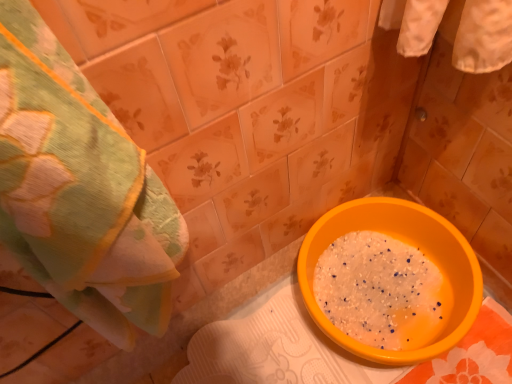
Question: In the image, is orange plastic basin at lower right positioned in front of or behind green textured towel at left?

Choices:
 (A) behind
 (B) front

Answer: (A)

Question: Considering the positions of orange plastic basin at lower right and green textured towel at left in the image, is orange plastic basin at lower right bigger or smaller than green textured towel at left?

Choices:
 (A) small
 (B) big

Answer: (B)

Question: Looking at their shapes, would you say orange plastic basin at lower right is wider or thinner than green textured towel at left?

Choices:
 (A) wide
 (B) thin

Answer: (A)

Question: Considering the relative positions of green textured towel at left and orange plastic basin at lower right in the image provided, is green textured towel at left to the left or to the right of orange plastic basin at lower right?

Choices:
 (A) right
 (B) left

Answer: (B)

Question: From the image's perspective, is green textured towel at left located above or below orange plastic basin at lower right?

Choices:
 (A) below
 (B) above

Answer: (B)

Question: Is green textured towel at left wider or thinner than orange plastic basin at lower right?

Choices:
 (A) wide
 (B) thin

Answer: (B)

Question: Relative to orange plastic basin at lower right, is green textured towel at left in front or behind?

Choices:
 (A) behind
 (B) front

Answer: (B)